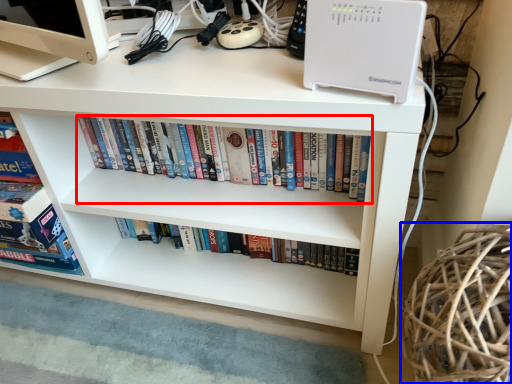
Question: Which object appears closest to the camera in this image, book (highlighted by a red box) or basket (highlighted by a blue box)?

Choices:
 (A) book
 (B) basket

Answer: (B)